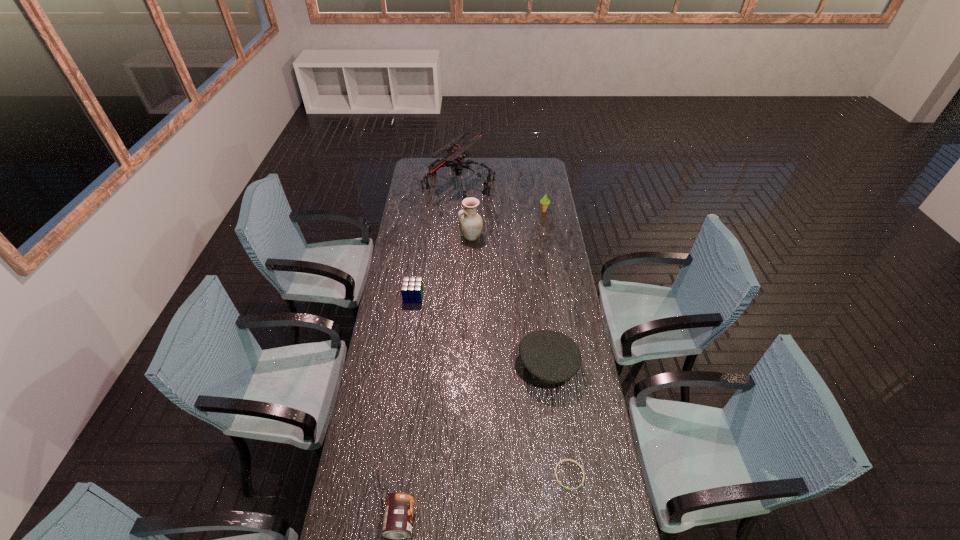
Find the location of a particular element. The image size is (960, 540). drone is located at coordinates (457, 153).

At what (x,y) coordinates should I click in order to perform the action: click on the tallest object. Please return your answer as a coordinate pair (x, y). This screenshot has height=540, width=960. Looking at the image, I should click on (457, 153).

Locate an element on the screen. the second tallest object is located at coordinates (470, 223).

What are the coordinates of `pottery` in the screenshot? It's located at point(470,223).

Locate an element on the screen. icecream is located at coordinates (544, 201).

You are a GUI agent. You are given a task and a screenshot of the screen. Output one action in this format:
    pyautogui.click(x=<x>, y=<y>)
    Task: Click on the beret
    Image resolution: width=960 pixels, height=540 pixels.
    Given the screenshot: What is the action you would take?
    pyautogui.click(x=545, y=357)

The image size is (960, 540). I want to click on the fourth farthest object, so click(412, 289).

Identify the location of the nearest object. (398, 517).

At what (x,y) coordinates should I click in order to perform the action: click on the second nearest object. Please return your answer as a coordinate pair (x, y). This screenshot has width=960, height=540. Looking at the image, I should click on (557, 480).

Identify the location of the shortest object. This screenshot has width=960, height=540. (557, 480).